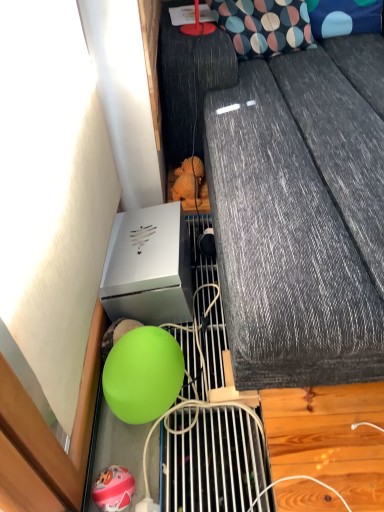
Question: From a real-world perspective, is blue dotted fabric pillow at upper right, the first pillow when ordered from right to left, physically located above or below green rubber ball at lower left?

Choices:
 (A) above
 (B) below

Answer: (A)

Question: Considering the relative positions of blue dotted fabric pillow at upper right, the first pillow when ordered from right to left, and green rubber ball at lower left in the image provided, is blue dotted fabric pillow at upper right, the first pillow when ordered from right to left, to the left or to the right of green rubber ball at lower left?

Choices:
 (A) right
 (B) left

Answer: (A)

Question: Which is nearer to the matte green balloon at lower left?

Choices:
 (A) blue dotted fabric pillow at upper right, the first pillow when ordered from right to left
 (B) green matte ball at lower center
 (C) polka dot fabric pillow at upper center, positioned as the 1th pillow in left-to-right order
 (D) green rubber ball at lower left

Answer: (B)

Question: Estimate the real-world distances between objects in this image. Which object is closer to the blue dotted fabric pillow at upper right, the 2th pillow when ordered from left to right?

Choices:
 (A) green matte ball at lower center
 (B) matte green balloon at lower left
 (C) polka dot fabric pillow at upper center, positioned as the 1th pillow in left-to-right order
 (D) green rubber ball at lower left

Answer: (C)